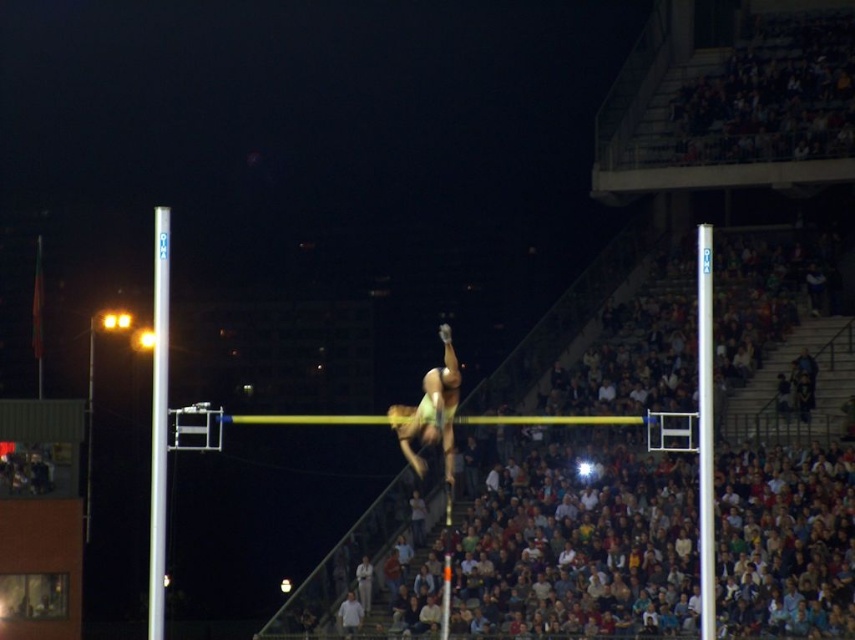
You are a photographer at the event and want to capture a photo of both silver metallic pole at left and silver metallic pole at center in the same frame. From which side of the poles should you position yourself to ensure both are visible?

You should position yourself to the right of both silver metallic pole at left and silver metallic pole at center so that you can see both poles since the silver metallic pole at left is to the left of silver metallic pole at center.

You are a judge at the high jump event. You need to determine if the athlete cleared the bar successfully. Based on the image, is the silver metallic pole at center above or below the green fabric athlete at center?

The silver metallic pole at center is located above the green fabric athlete at center, indicating the athlete successfully cleared the bar.